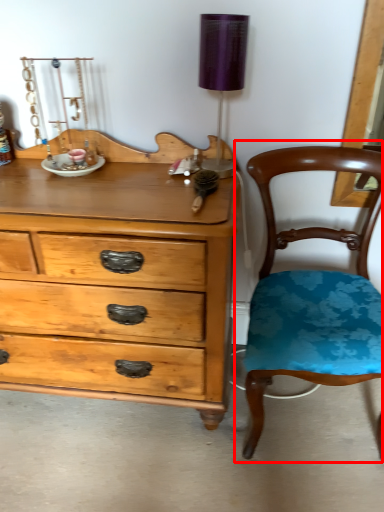
Question: From the image's perspective, where is chair (annotated by the red box) located in relation to table lamp in the image?

Choices:
 (A) below
 (B) above

Answer: (A)